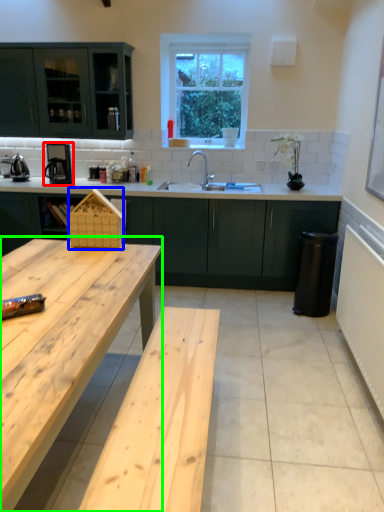
Question: Considering the real-world distances, which object is farthest from coffee machine (highlighted by a red box)? basket (highlighted by a blue box) or table (highlighted by a green box)?

Choices:
 (A) basket
 (B) table

Answer: (B)